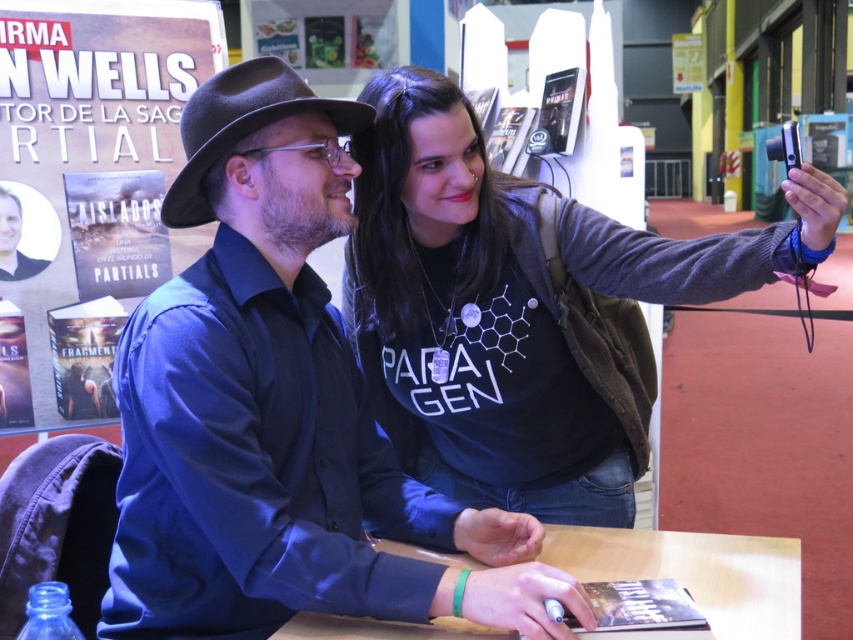
Question: Does wooden table at center have a greater width compared to black felt fedora at upper center?

Choices:
 (A) yes
 (B) no

Answer: (A)

Question: Is matte black book at upper left wider than wooden table at center?

Choices:
 (A) yes
 (B) no

Answer: (B)

Question: Which object appears closest to the camera in this image?

Choices:
 (A) dark gray sweater at upper right
 (B) matte black book at upper left

Answer: (A)

Question: Which of the following is the farthest from the observer?

Choices:
 (A) (281, 108)
 (B) (780, 579)
 (C) (142, 253)

Answer: (C)

Question: Is matte black shirt at center below black felt fedora at upper center?

Choices:
 (A) no
 (B) yes

Answer: (B)

Question: Which object is farther from the camera taking this photo?

Choices:
 (A) black felt fedora at upper center
 (B) dark gray sweater at upper right

Answer: (A)